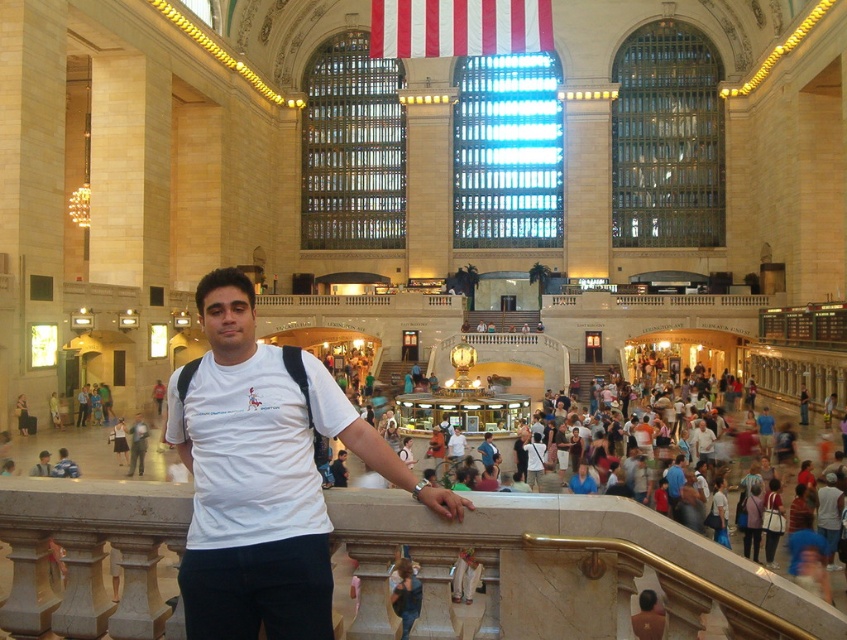
Can you confirm if white t-shirt at center is smaller than white striped fabric at upper center?

Actually, white t-shirt at center might be larger than white striped fabric at upper center.

Who is more forward, (x=269, y=428) or (x=529, y=3)?

Point (x=269, y=428) is in front.

Describe the element at coordinates (263, 474) in the screenshot. This screenshot has width=847, height=640. I see `white t-shirt at center` at that location.

This screenshot has width=847, height=640. I want to click on white t-shirt at center, so click(263, 474).